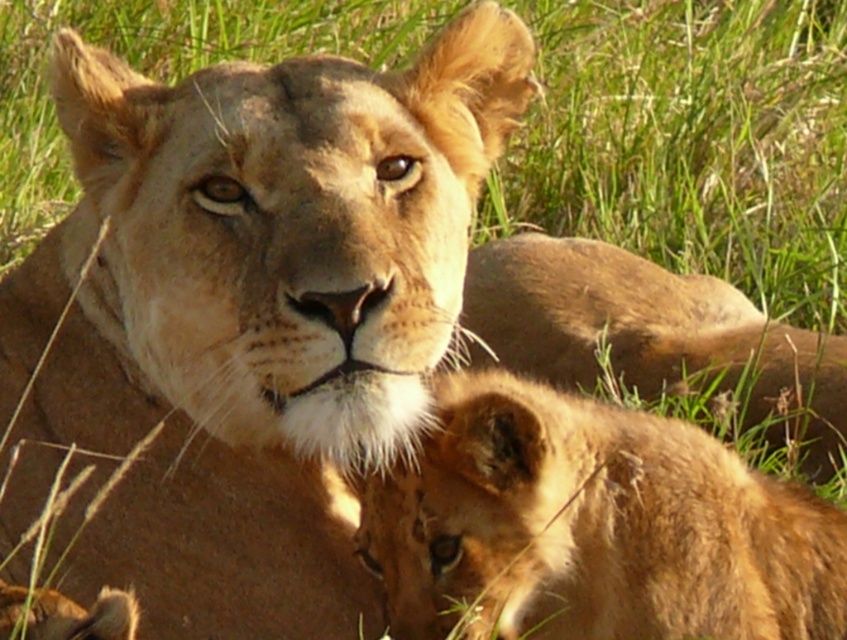
Between golden fur lion at center and golden fur lion cub at lower center, which one has less height?

With less height is golden fur lion cub at lower center.

Describe the element at coordinates (245, 317) in the screenshot. I see `golden fur lion at center` at that location.

Locate an element on the screen. The image size is (847, 640). golden fur lion at center is located at coordinates (245, 317).

Which is more to the right, golden fur cub at lower right or golden fur lion cub at lower center?

From the viewer's perspective, golden fur lion cub at lower center appears more on the right side.

Which is behind, point (722, 616) or point (562, 291)?

Point (562, 291)

Find the location of `golden fur cub at lower right`. golden fur cub at lower right is located at coordinates (591, 525).

This screenshot has height=640, width=847. What are the coordinates of `golden fur lion at center` in the screenshot? It's located at (245, 317).

Measure the distance between point (26, 262) and camera.

Point (26, 262) and camera are 2.09 meters apart from each other.

At what (x,y) coordinates should I click in order to perform the action: click on golden fur lion at center. Please return your answer as a coordinate pair (x, y). Looking at the image, I should click on (245, 317).

In order to click on golden fur lion at center in this screenshot , I will do `click(245, 317)`.